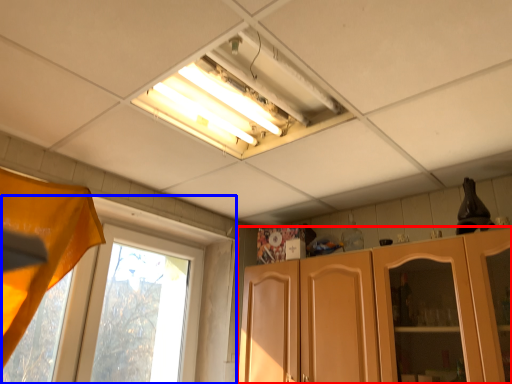
Question: Which point is closer to the camera, cabinetry (highlighted by a red box) or window (highlighted by a blue box)?

Choices:
 (A) cabinetry
 (B) window

Answer: (A)